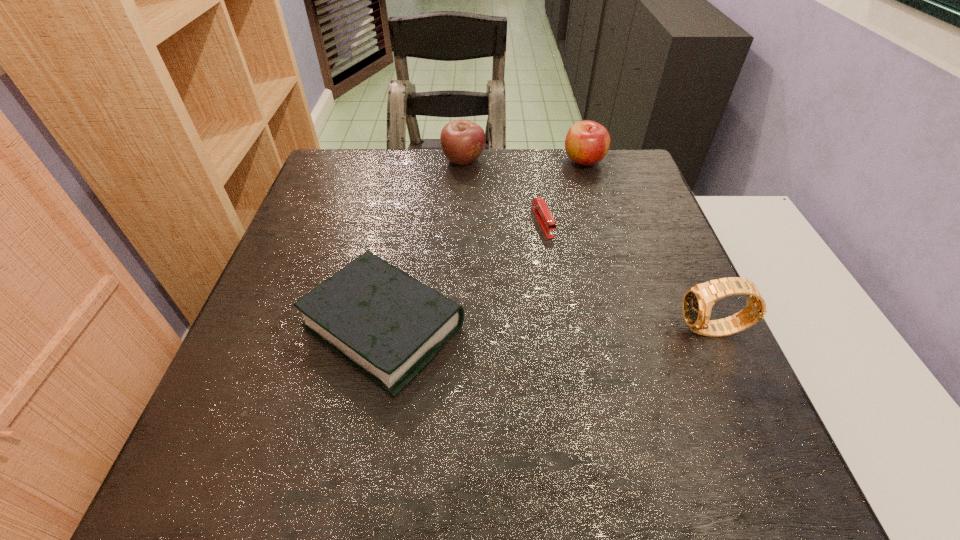
I want to click on Bible, so click(390, 326).

You are a GUI agent. You are given a task and a screenshot of the screen. Output one action in this format:
    pyautogui.click(x=<x>, y=<y>)
    Task: Click on the watch
    
    Given the screenshot: What is the action you would take?
    pyautogui.click(x=698, y=300)

Image resolution: width=960 pixels, height=540 pixels. In order to click on the left apple in this screenshot , I will do `click(462, 141)`.

Image resolution: width=960 pixels, height=540 pixels. In order to click on the third object from right to left in this screenshot , I will do `click(541, 211)`.

Identify the location of the third nearest object. (541, 211).

Identify the location of the right apple. The width and height of the screenshot is (960, 540). (587, 142).

I want to click on vacant region located on the right of the second shortest object, so click(x=649, y=327).

The image size is (960, 540). I want to click on free space located on the face of the rightmost object, so click(x=603, y=331).

Image resolution: width=960 pixels, height=540 pixels. In order to click on free spot located on the face of the rightmost object in this screenshot , I will do `click(644, 331)`.

I want to click on free space located on the face of the rightmost object, so click(505, 331).